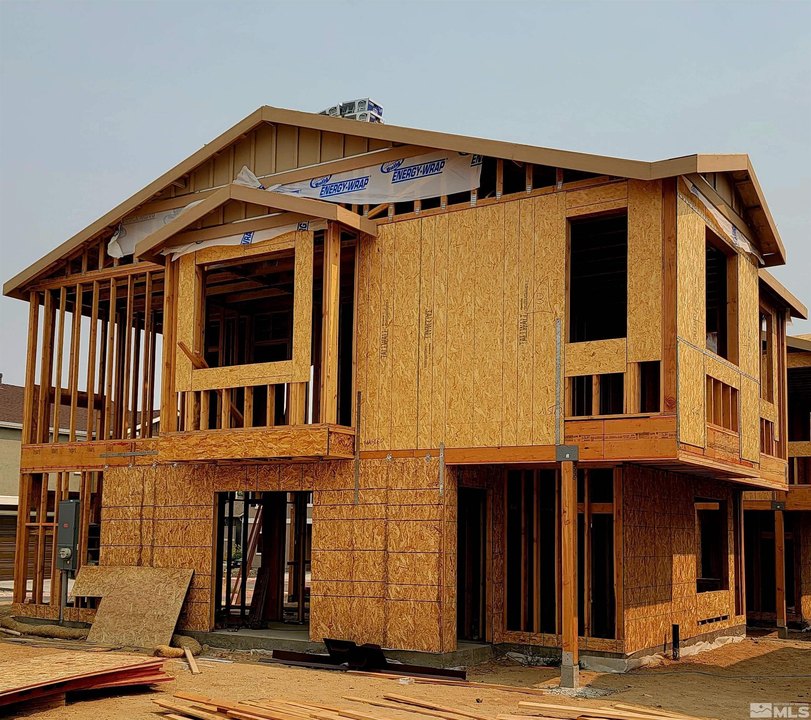
Where is `wood panel`? The width and height of the screenshot is (811, 720). wood panel is located at coordinates (168, 588).